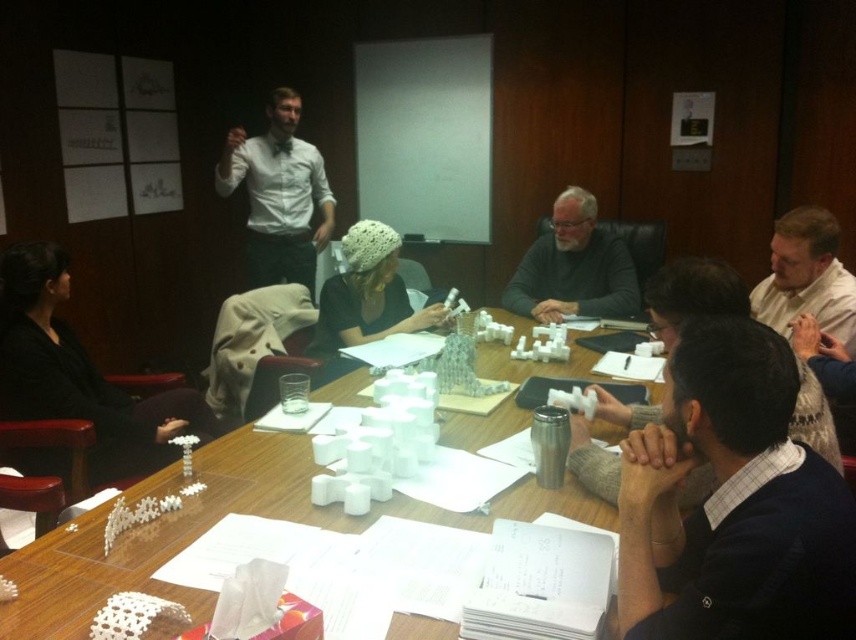
Can you confirm if black fabric jacket at lower left is smaller than gray matte sweater at center?

Incorrect, black fabric jacket at lower left is not smaller in size than gray matte sweater at center.

Which of these two, black fabric jacket at lower left or gray matte sweater at center, stands shorter?

Standing shorter between the two is gray matte sweater at center.

You are a GUI agent. You are given a task and a screenshot of the screen. Output one action in this format:
    pyautogui.click(x=<x>, y=<y>)
    Task: Click on the black fabric jacket at lower left
    The image size is (856, 640).
    Given the screenshot: What is the action you would take?
    pyautogui.click(x=79, y=374)

Is point (604, 483) in front of point (355, 320)?

Yes, point (604, 483) is closer to viewer.

Is dark gray sweater at lower right further to camera compared to white knitted hat at center?

No, it is in front of white knitted hat at center.

At what (x,y) coordinates should I click in order to perform the action: click on dark gray sweater at lower right. Please return your answer as a coordinate pair (x, y). The width and height of the screenshot is (856, 640). Looking at the image, I should click on (693, 294).

In the scene shown: Is dark blue shirt at lower right to the right of gray matte sweater at center from the viewer's perspective?

In fact, dark blue shirt at lower right is to the left of gray matte sweater at center.

Between point (676, 420) and point (631, 282), which one is positioned behind?

The point (631, 282) is behind.

The height and width of the screenshot is (640, 856). Find the location of `dark blue shirt at lower right`. dark blue shirt at lower right is located at coordinates (733, 502).